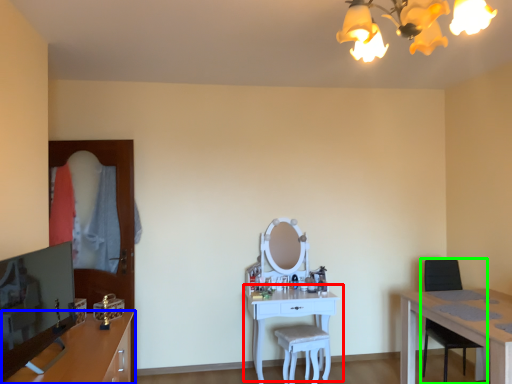
Question: Considering the real-world distances, which object is farthest from table (highlighted by a red box)? cabinetry (highlighted by a blue box) or chair (highlighted by a green box)?

Choices:
 (A) cabinetry
 (B) chair

Answer: (A)